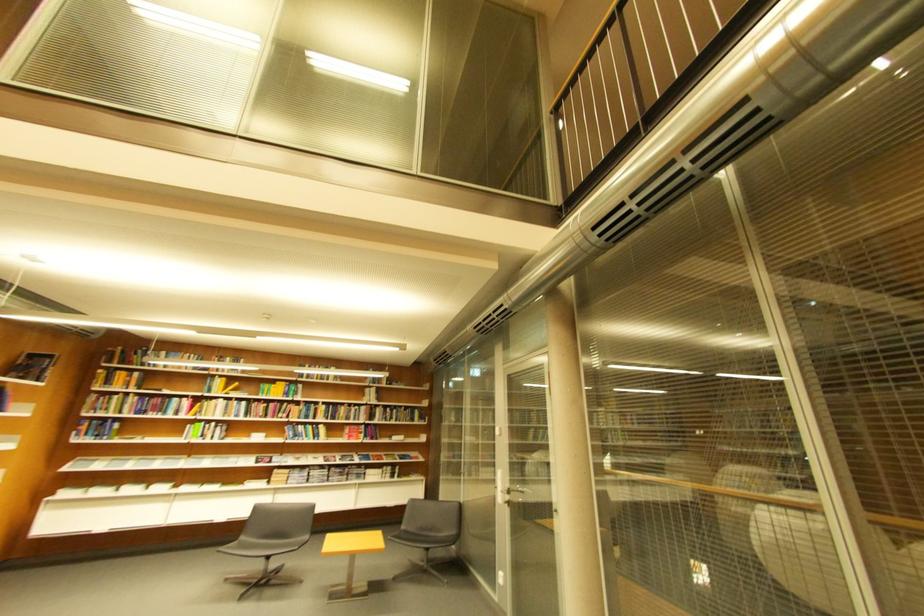
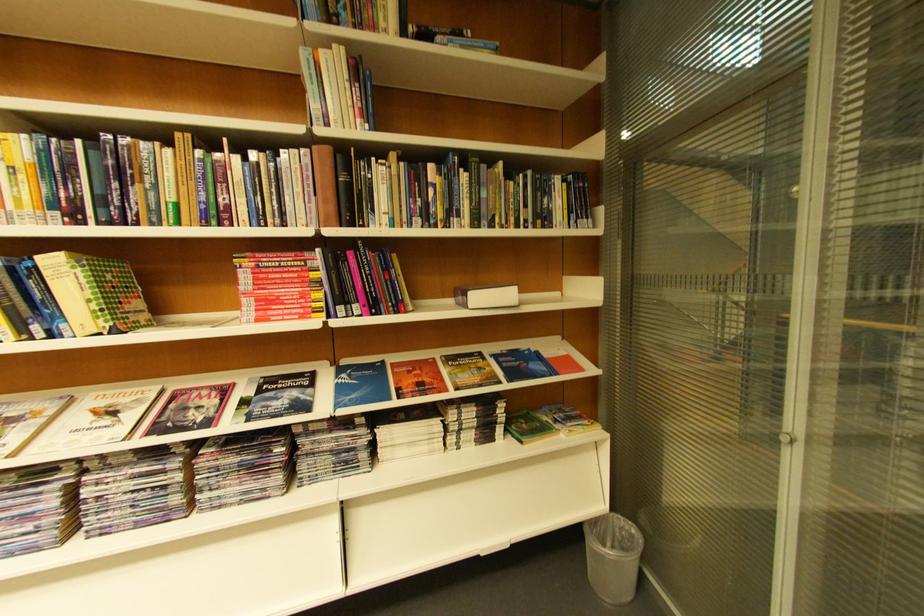
Find the pixel in the second image that matches point (332, 428) in the first image.

(63, 264)